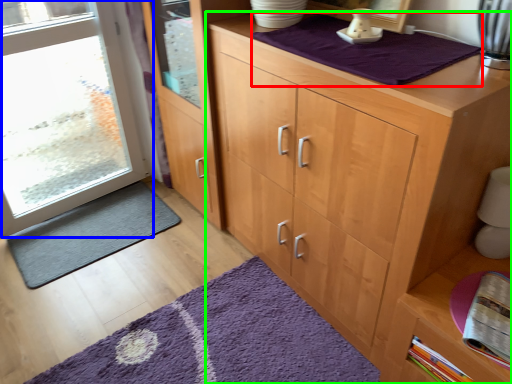
Question: Which object is positioned farthest from blanket (highlighted by a red box)? Select from door (highlighted by a blue box) and cupboard (highlighted by a green box).

Choices:
 (A) door
 (B) cupboard

Answer: (A)